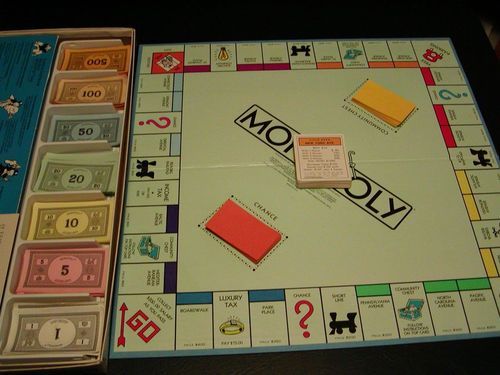
In order to click on piles of monopoly money and game cards in this screenshot , I will do `click(246, 233)`, `click(321, 163)`, `click(386, 102)`, `click(104, 54)`, `click(96, 91)`, `click(93, 122)`, `click(87, 169)`, `click(79, 219)`, `click(76, 273)`, `click(59, 322)`.